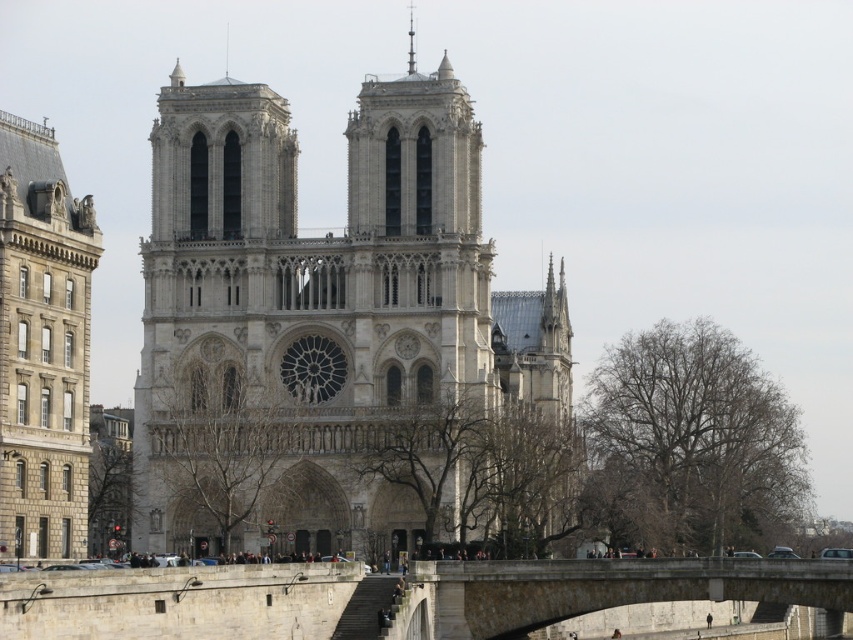
Question: Where is gray stone cathedral at center located in relation to gray stone tower at left in the image?

Choices:
 (A) above
 (B) below

Answer: (A)

Question: Which object appears farthest from the camera in this image?

Choices:
 (A) smooth silver spire at upper center
 (B) gray stone cathedral at center
 (C) gray stone bridge at lower center
 (D) gray stone tower at left

Answer: (A)

Question: In this image, where is gray stone cathedral at center located relative to gray stone bridge at lower center?

Choices:
 (A) above
 (B) below

Answer: (A)

Question: Does gray stone tower at left have a larger size compared to gray stone bridge at lower center?

Choices:
 (A) yes
 (B) no

Answer: (B)

Question: Which object is farther from the camera taking this photo?

Choices:
 (A) gray stone tower at left
 (B) smooth silver spire at upper center
 (C) gray stone cathedral at center

Answer: (B)

Question: Among these objects, which one is nearest to the camera?

Choices:
 (A) gray stone cathedral at center
 (B) smooth silver spire at upper center
 (C) gray stone bridge at lower center

Answer: (C)